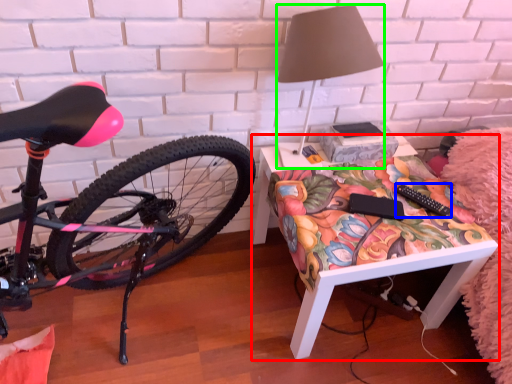
Question: Which is nearer to the desk (highlighted by a red box)? remote control (highlighted by a blue box) or lamp (highlighted by a green box).

Choices:
 (A) remote control
 (B) lamp

Answer: (A)